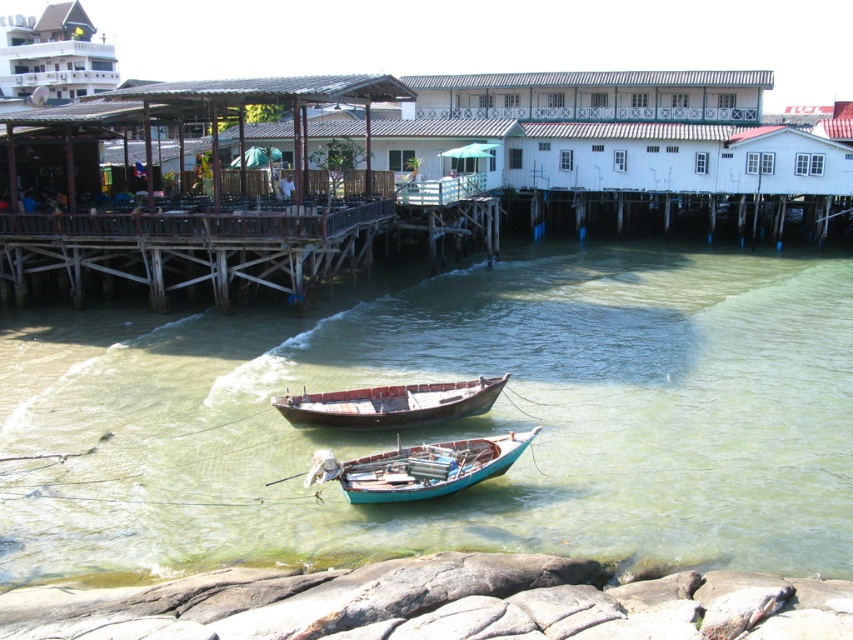
You are a photographer wanting to capture both the teal wooden boat at center and the rusty wooden boat at center in the same frame. Based on their positions, which boat will appear closer to the camera in the photo?

The teal wooden boat at center will appear closer to the camera because it is positioned in front of the rusty wooden boat at center.